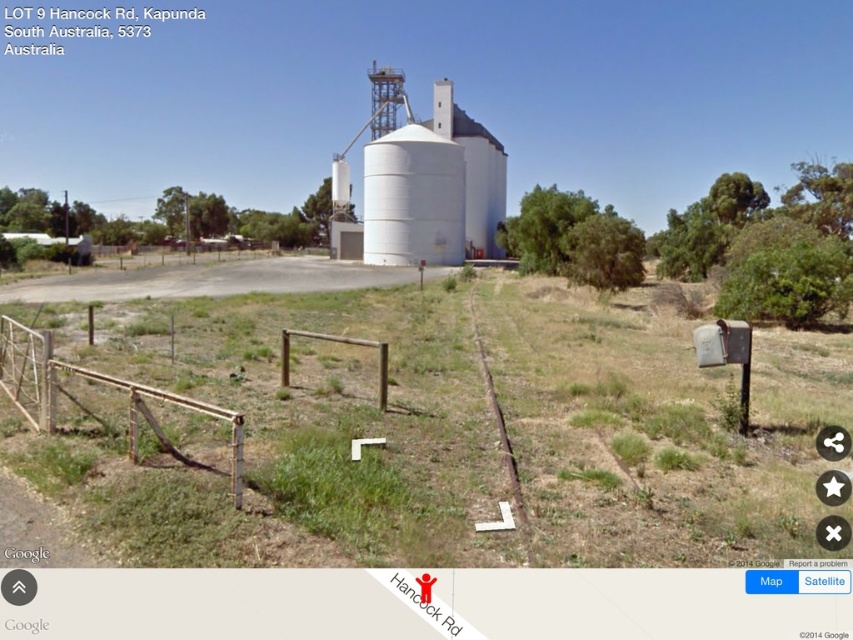
You are a farmer planning to install a new fence that needs to be as wide as the white smooth silo at center. Given that the brown wooden fence at left is currently 2 meters wide, can you determine if the new fence will be wider than the existing one?

The white smooth silo at center is wider than the brown wooden fence at left. Since the brown wooden fence at left is 2 meters wide, the new fence, which is as wide as the silo, will be wider than the existing one.

You are a farmer planning to install a new irrigation system. You need to know which object in the scene is wider to determine where to place the main water pipe. Which is wider, the white matte silo at center or the brown wooden fence at left?

The white matte silo at center is wider than the brown wooden fence at left, so the main water pipe should be placed near the silo.